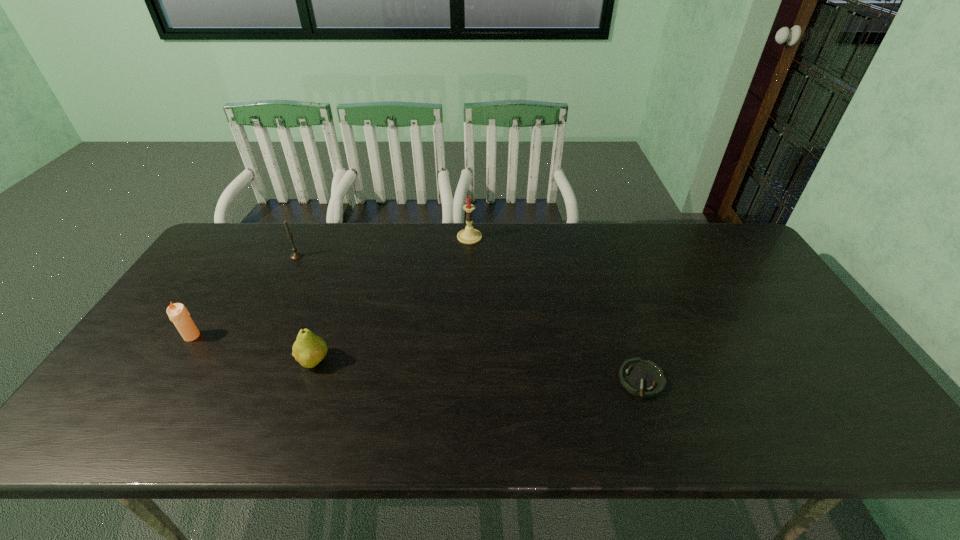
In order to click on vacant space located 0.120m on the back of the second candle from right to left in this screenshot , I will do click(309, 231).

You are a GUI agent. You are given a task and a screenshot of the screen. Output one action in this format:
    pyautogui.click(x=<x>, y=<y>)
    Task: Click on the vacant area situated on the front of the third object from left to right
    
    Given the screenshot: What is the action you would take?
    pyautogui.click(x=284, y=443)

I want to click on free location located on the right of the leftmost object, so click(x=219, y=336).

I want to click on vacant area situated on the back of the rightmost object, so click(x=612, y=294).

The height and width of the screenshot is (540, 960). I want to click on object that is positioned at the left edge, so click(178, 314).

Locate an element on the screen. The height and width of the screenshot is (540, 960). vacant region at the far edge is located at coordinates (566, 224).

This screenshot has height=540, width=960. Identify the location of free location at the near edge of the desktop. [x=306, y=408].

The image size is (960, 540). I want to click on vacant position at the left edge of the desktop, so click(113, 403).

In the image, there is a desktop. Identify the location of free space at the right edge. The width and height of the screenshot is (960, 540). (813, 341).

Image resolution: width=960 pixels, height=540 pixels. What are the coordinates of `free region at the far left corner of the desktop` in the screenshot? It's located at (262, 248).